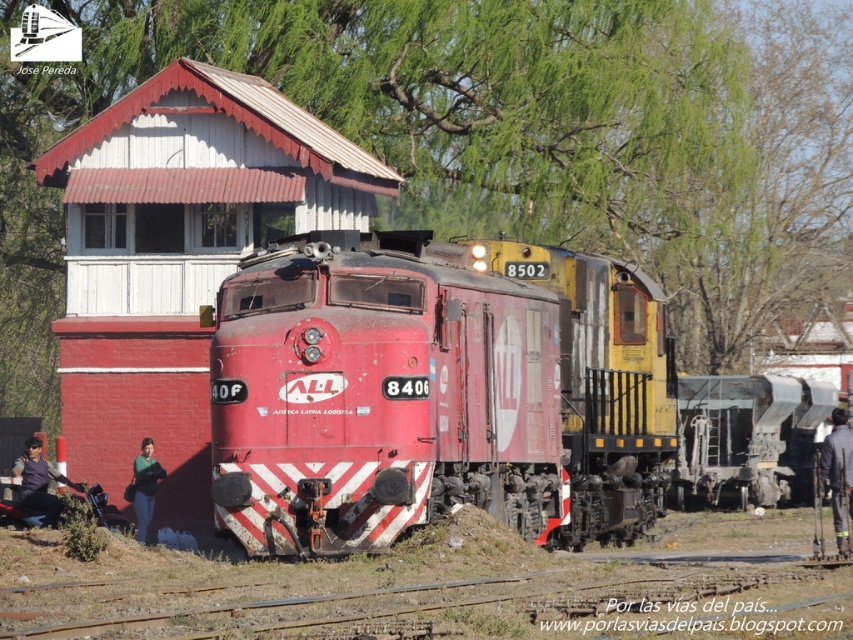
Which is below, metallic gray tank car at center or dark blue uniform at center?

Positioned lower is metallic gray tank car at center.

Measure the distance between metallic gray tank car at center and camera.

A distance of 33.54 meters exists between metallic gray tank car at center and camera.

The height and width of the screenshot is (640, 853). I want to click on metallic gray tank car at center, so click(x=747, y=438).

Is point (199, 77) more distant than point (32, 448)?

Yes, point (199, 77) is farther from viewer.

Is point (164, 216) closer to viewer compared to point (22, 496)?

That is False.

Identify the location of brick railway station at center. Image resolution: width=853 pixels, height=640 pixels. (178, 253).

Can you confirm if dark blue uniform at center is thinner than dark blue fabric jacket at lower left?

In fact, dark blue uniform at center might be wider than dark blue fabric jacket at lower left.

Where is `dark blue uniform at center`? The width and height of the screenshot is (853, 640). dark blue uniform at center is located at coordinates (838, 474).